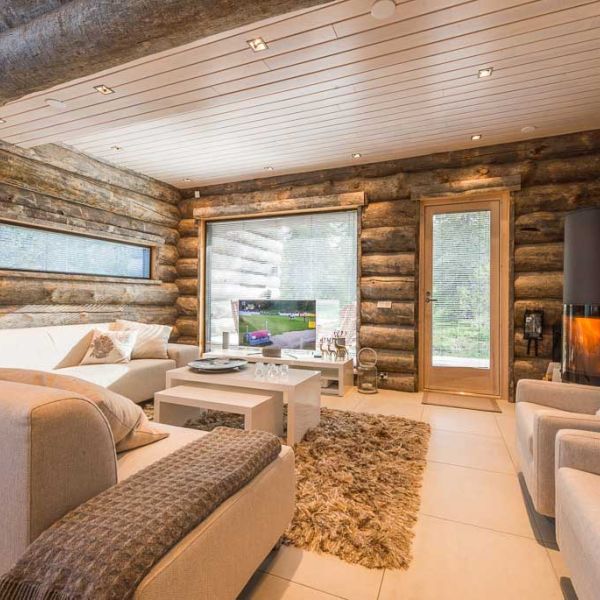
This screenshot has width=600, height=600. Identify the location of at least 3 visible glasses. (286, 371), (275, 373), (258, 375).